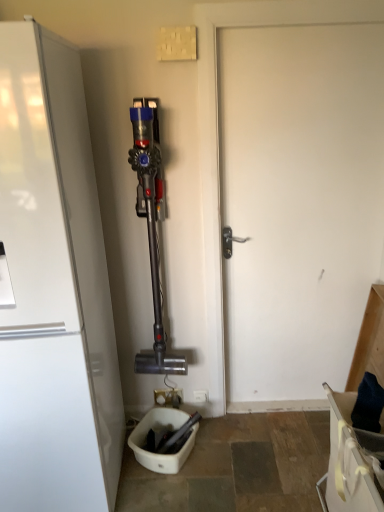
Question: From a real-world perspective, is white glossy refrigerator at left on top of white plastic electric outlet at center?

Choices:
 (A) no
 (B) yes

Answer: (B)

Question: Does white glossy refrigerator at left lie in front of white plastic electric outlet at center?

Choices:
 (A) yes
 (B) no

Answer: (A)

Question: From the image's perspective, is white glossy refrigerator at left above white plastic electric outlet at center?

Choices:
 (A) yes
 (B) no

Answer: (A)

Question: Could white plastic electric outlet at center be considered to be inside white glossy refrigerator at left?

Choices:
 (A) yes
 (B) no

Answer: (B)

Question: Is the position of white glossy refrigerator at left more distant than that of white plastic electric outlet at center?

Choices:
 (A) yes
 (B) no

Answer: (B)

Question: Relative to white plastic electric outlet at center, is white glossy refrigerator at left in front or behind?

Choices:
 (A) front
 (B) behind

Answer: (A)

Question: Considering the relative positions of white glossy refrigerator at left and white plastic electric outlet at center in the image provided, is white glossy refrigerator at left to the left or to the right of white plastic electric outlet at center?

Choices:
 (A) right
 (B) left

Answer: (B)

Question: Looking at their shapes, would you say white glossy refrigerator at left is wider or thinner than white plastic electric outlet at center?

Choices:
 (A) wide
 (B) thin

Answer: (A)

Question: Considering the positions of white glossy refrigerator at left and white plastic electric outlet at center in the image, is white glossy refrigerator at left taller or shorter than white plastic electric outlet at center?

Choices:
 (A) short
 (B) tall

Answer: (B)

Question: Is point (203, 394) closer or farther from the camera than point (314, 99)?

Choices:
 (A) closer
 (B) farther

Answer: (B)

Question: From the image's perspective, is white plastic electric outlet at center located above or below white matte door at center?

Choices:
 (A) below
 (B) above

Answer: (A)

Question: From a real-world perspective, is white plastic electric outlet at center positioned above or below white matte door at center?

Choices:
 (A) below
 (B) above

Answer: (A)

Question: Looking at their shapes, would you say white plastic electric outlet at center is wider or thinner than white matte door at center?

Choices:
 (A) thin
 (B) wide

Answer: (A)

Question: Is white plastic electric outlet at center spatially inside white glossy refrigerator at left, or outside of it?

Choices:
 (A) outside
 (B) inside

Answer: (A)

Question: Considering the positions of white plastic electric outlet at center and white glossy refrigerator at left in the image, is white plastic electric outlet at center taller or shorter than white glossy refrigerator at left?

Choices:
 (A) short
 (B) tall

Answer: (A)